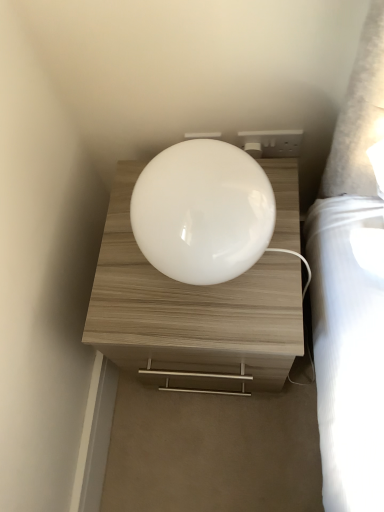
At what (x,y) coordinates should I click in order to perform the action: click on free location to the left of white glossy lampshade at center. Please return your answer as a coordinate pair (x, y). The width and height of the screenshot is (384, 512). Looking at the image, I should click on (120, 284).